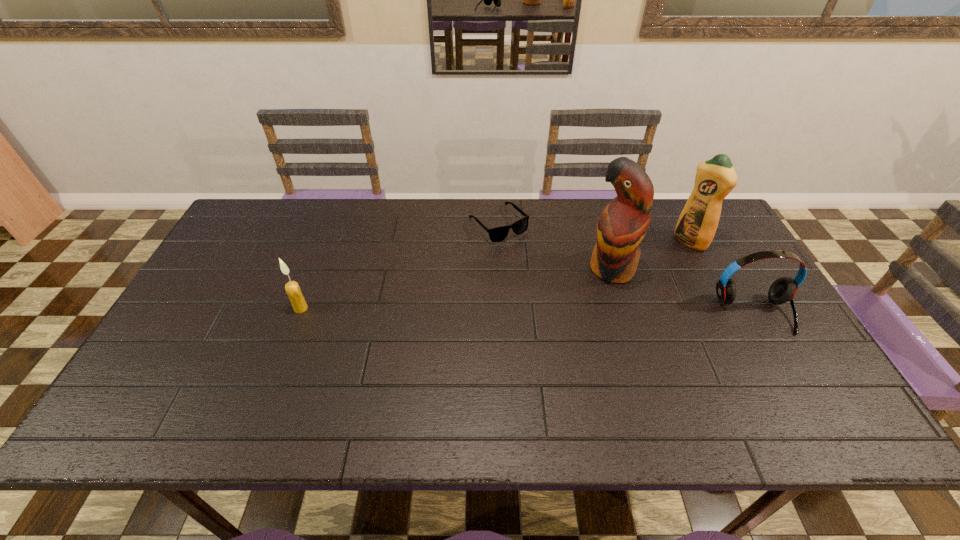
Image resolution: width=960 pixels, height=540 pixels. Find the location of `vacant space on the desktop that is between the leftmost object and the headset and is positioned on the face of the tallest object`. vacant space on the desktop that is between the leftmost object and the headset and is positioned on the face of the tallest object is located at coordinates (558, 311).

This screenshot has height=540, width=960. Identify the location of vacant space on the desktop that is between the leftmost object and the headset and is positioned on the front-facing side of the shortest object. (581, 312).

You are a GUI agent. You are given a task and a screenshot of the screen. Output one action in this format:
    pyautogui.click(x=<x>, y=<y>)
    Task: Click on the free spot on the desktop that is between the candle and the headset and is positioned on the label of the fourth shortest object
    The image size is (960, 540).
    Given the screenshot: What is the action you would take?
    pyautogui.click(x=591, y=312)